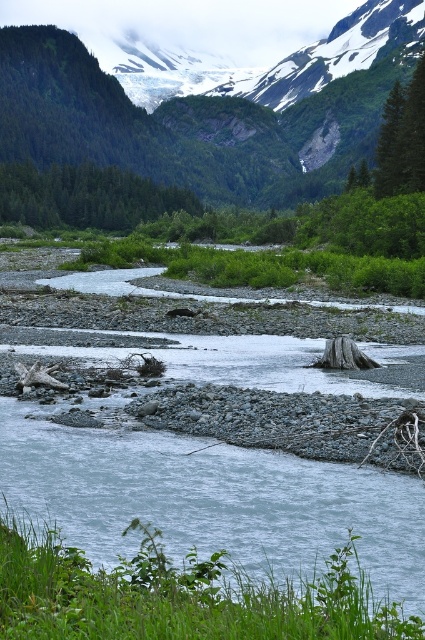
Question: Which object is positioned farthest from the green textured tree at upper right?

Choices:
 (A) green matte tree at center
 (B) green forested mountain at upper center

Answer: (B)

Question: Where is green forested mountain at upper center located in relation to green textured tree at upper right in the image?

Choices:
 (A) left
 (B) right

Answer: (A)

Question: Estimate the real-world distances between objects in this image. Which object is closer to the green textured tree at upper right?

Choices:
 (A) green forested mountain at upper center
 (B) green matte tree at center

Answer: (B)

Question: Is green matte tree at center bigger than green textured tree at upper right?

Choices:
 (A) yes
 (B) no

Answer: (A)

Question: Does green matte tree at center appear on the left side of green textured tree at upper right?

Choices:
 (A) no
 (B) yes

Answer: (B)

Question: Which of the following is the closest to the observer?

Choices:
 (A) green forested mountain at upper center
 (B) green textured tree at upper right

Answer: (B)